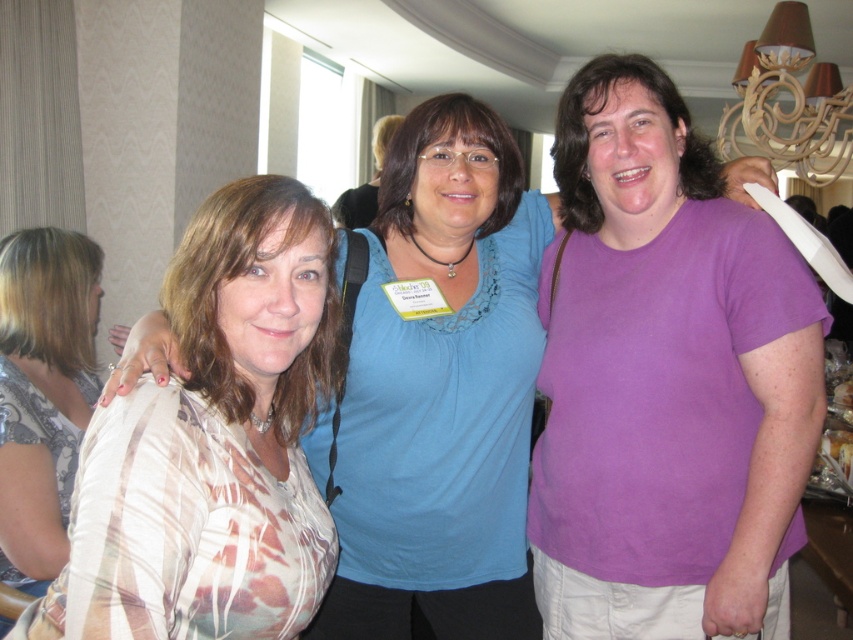
Measure the distance from plaid fabric shirt at center to plaid fabric shirt at left.

A distance of 30.88 inches exists between plaid fabric shirt at center and plaid fabric shirt at left.

Which is below, plaid fabric shirt at center or plaid fabric shirt at left?

plaid fabric shirt at left

Who is more forward, (445, 618) or (93, 369)?

Point (445, 618)

The image size is (853, 640). I want to click on plaid fabric shirt at center, so click(395, 436).

Who is higher up, purple matte shirt at center or plaid fabric shirt at center?

Positioned higher is purple matte shirt at center.

Who is positioned more to the right, purple matte shirt at center or plaid fabric shirt at center?

Positioned to the right is purple matte shirt at center.

I want to click on purple matte shirt at center, so click(666, 380).

Does printed fabric blouse at center have a smaller size compared to plaid fabric shirt at left?

Yes.

Describe the element at coordinates (213, 444) in the screenshot. The width and height of the screenshot is (853, 640). I see `printed fabric blouse at center` at that location.

You are a GUI agent. You are given a task and a screenshot of the screen. Output one action in this format:
    pyautogui.click(x=<x>, y=<y>)
    Task: Click on the printed fabric blouse at center
    The image size is (853, 640).
    Given the screenshot: What is the action you would take?
    pyautogui.click(x=213, y=444)